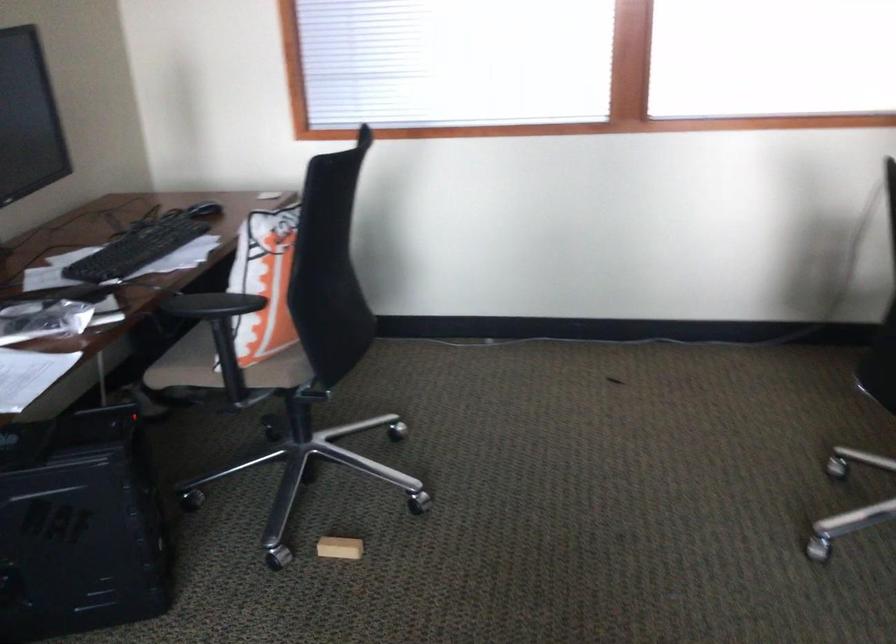
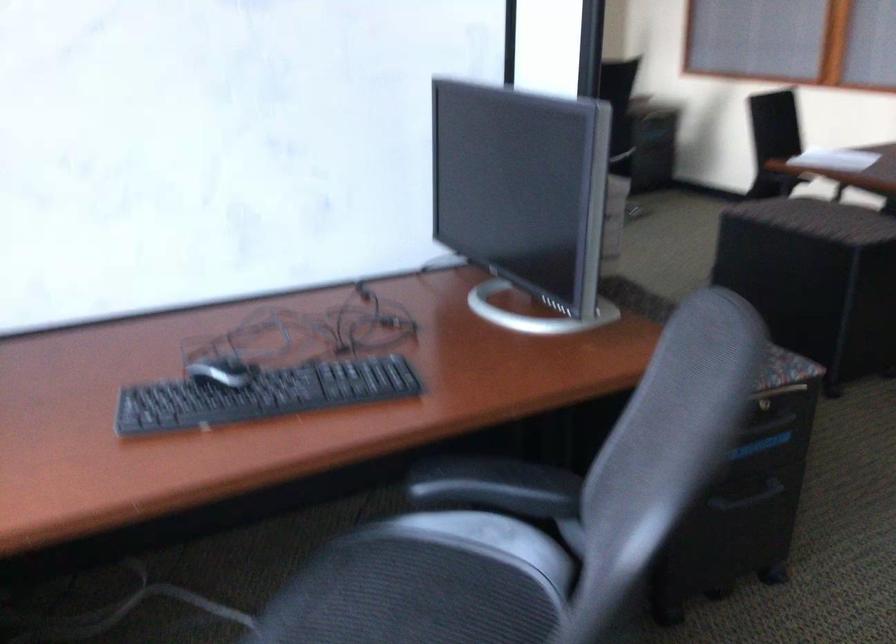
Question: I am providing you with two images of the same scene from different viewpoints. After the viewpoint changes to image2, which objects are now occluded?

Choices:
 (A) black chair armrest
 (B) chair sitting surface
 (C) computer mouse
 (D) paper with clip

Answer: (B)